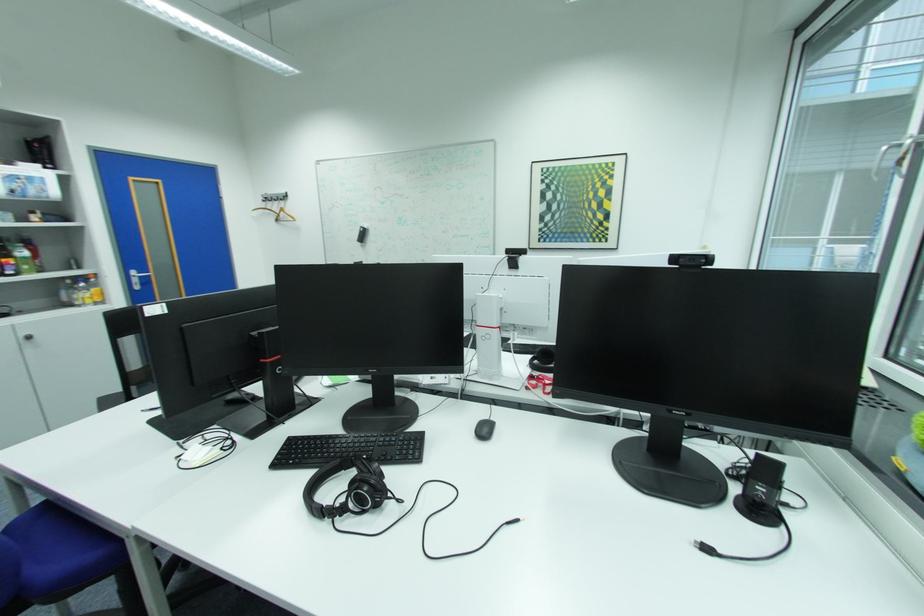
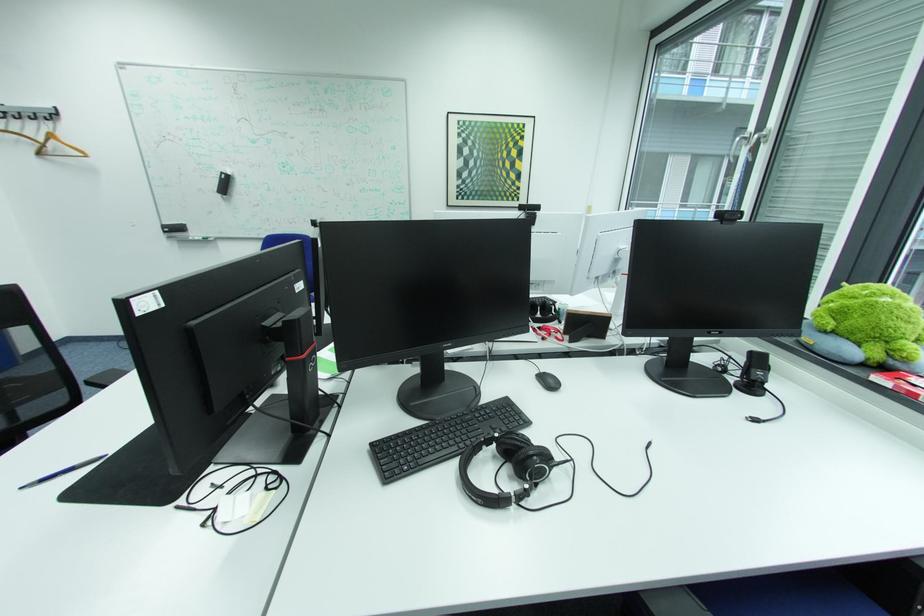
Find the pixel in the second image that matches [480,240] in the first image.

(393, 195)